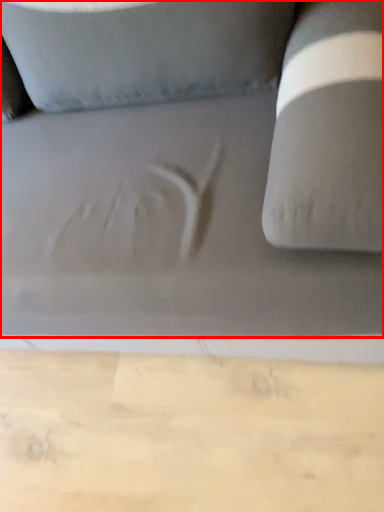
Question: Observing the image, what is the correct spatial positioning of studio couch (annotated by the red box) in reference to cardboard?

Choices:
 (A) right
 (B) left

Answer: (B)